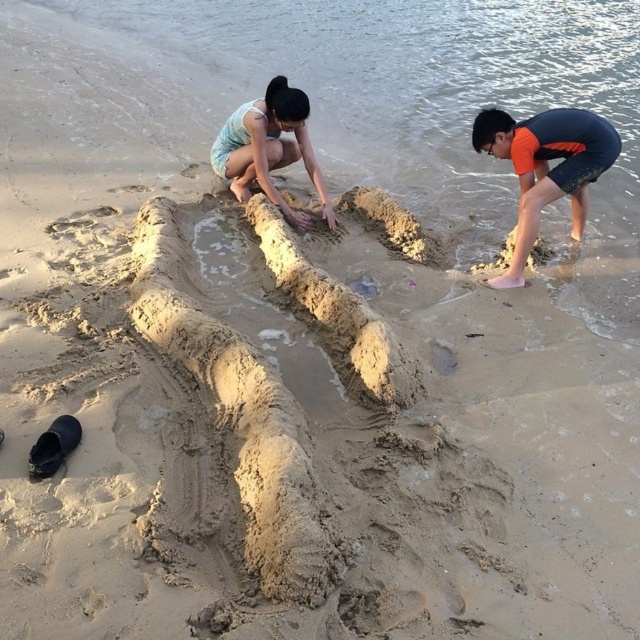
Looking at this image, you are a beachgoer who wants to place a 5 feet long beach umbrella between the orange fabric at right and the light blue fabric at center. Can you fit it there?

The distance between the orange fabric at right and the light blue fabric at center is 4.86 feet, which is slightly less than the 5 feet required for the umbrella. Therefore, the umbrella cannot be placed between them without overlapping the fabrics.

You are standing at the beach where the two people are building a sandcastle. You see the orange fabric at right and the light blue fabric at center. Which fabric is nearer to you?

The orange fabric at right is closer to the viewer than the light blue fabric at center, so the orange fabric at right is nearer to you.

You are a photographer at the beach and want to capture both the orange fabric at right and the light blue fabric at center in a single frame. Which fabric should you focus on first to ensure both are in the frame?

The orange fabric at right is taller than the light blue fabric at center, so you should focus on the orange fabric at right first to ensure both are in the frame.